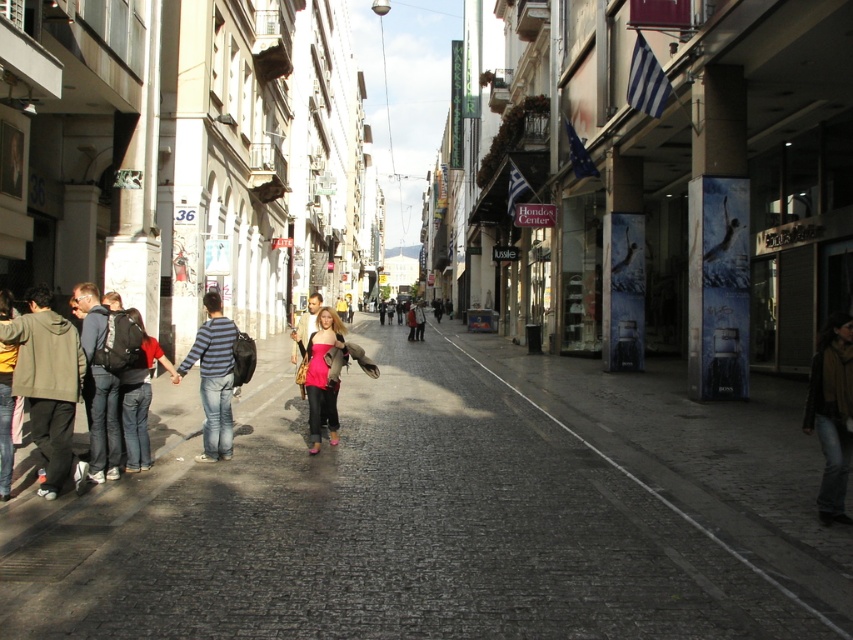
Question: Which object appears closest to the camera in this image?

Choices:
 (A) matte pink dress at center
 (B) brown woolen scarf at lower right

Answer: (B)

Question: Which of the following is the closest to the observer?

Choices:
 (A) (310, 356)
 (B) (811, 369)
 (C) (49, 456)

Answer: (B)

Question: Does brown woolen scarf at lower right have a larger size compared to striped cotton shirt at center?

Choices:
 (A) yes
 (B) no

Answer: (B)

Question: Does gray cobblestone pavement at center lie behind brown woolen scarf at lower right?

Choices:
 (A) yes
 (B) no

Answer: (B)

Question: Which point is closer to the camera?

Choices:
 (A) pyautogui.click(x=567, y=561)
 (B) pyautogui.click(x=311, y=444)

Answer: (A)

Question: Does striped cotton shirt at center appear on the left side of matte pink dress at center?

Choices:
 (A) yes
 (B) no

Answer: (A)